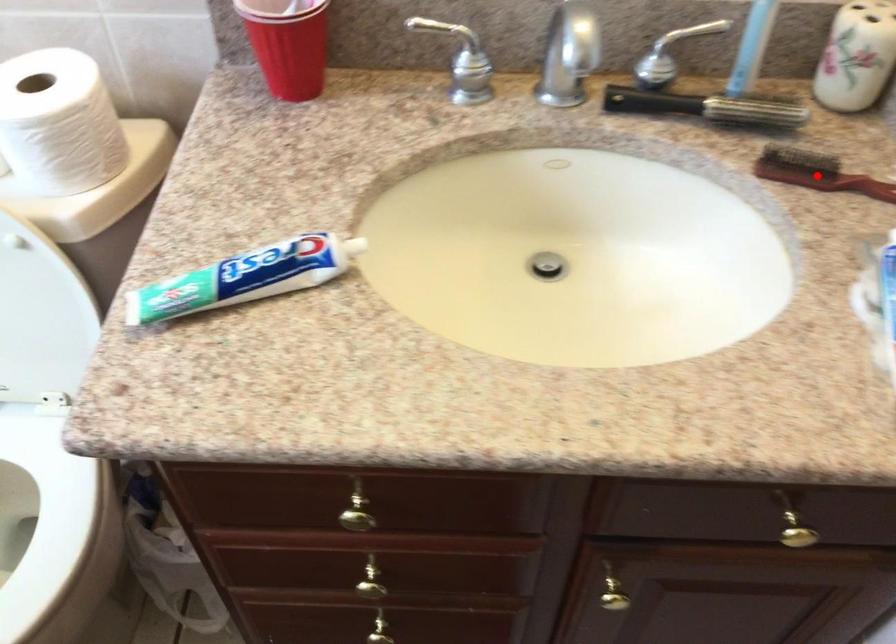
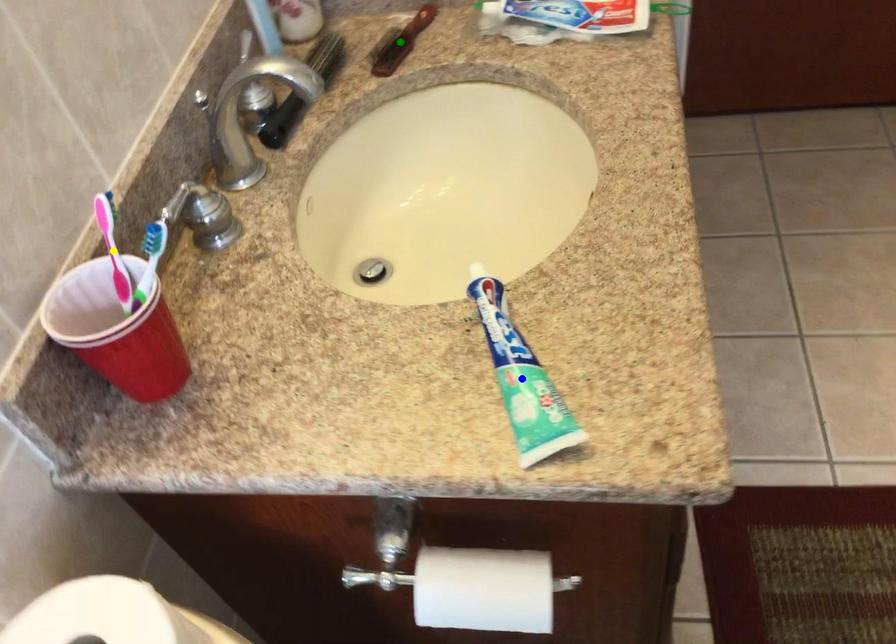
Question: I am providing you with two images of the same scene from different viewpoints. A red point is marked on the first image. You are given multiple points on the second image. Which mark in image 2 goes with the point in image 1?

Choices:
 (A) blue point
 (B) yellow point
 (C) green point

Answer: (C)